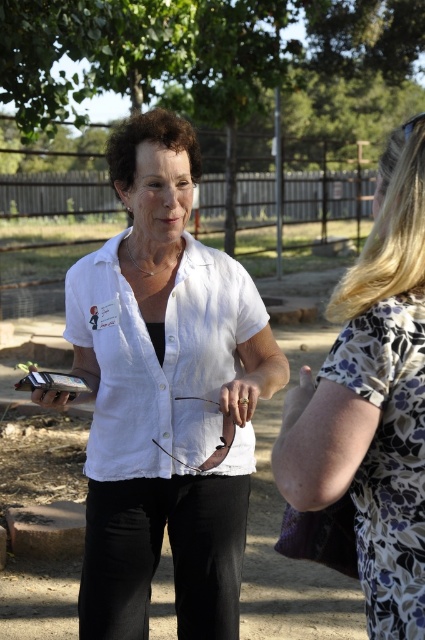
Question: Is white matte shirt at center positioned before floral fabric dress at center?

Choices:
 (A) yes
 (B) no

Answer: (B)

Question: Which point is closer to the camera?

Choices:
 (A) (396, 244)
 (B) (170, 308)

Answer: (A)

Question: Is white matte shirt at center positioned at the back of white linen shirt at center?

Choices:
 (A) yes
 (B) no

Answer: (B)

Question: Which object is farther from the camera taking this photo?

Choices:
 (A) white matte shirt at center
 (B) floral fabric dress at center

Answer: (A)

Question: Which object is farther from the camera taking this photo?

Choices:
 (A) white matte shirt at center
 (B) floral fabric dress at center
 (C) white linen shirt at center

Answer: (C)

Question: Considering the relative positions of floral fabric dress at center and white linen shirt at center in the image provided, where is floral fabric dress at center located with respect to white linen shirt at center?

Choices:
 (A) left
 (B) right

Answer: (B)